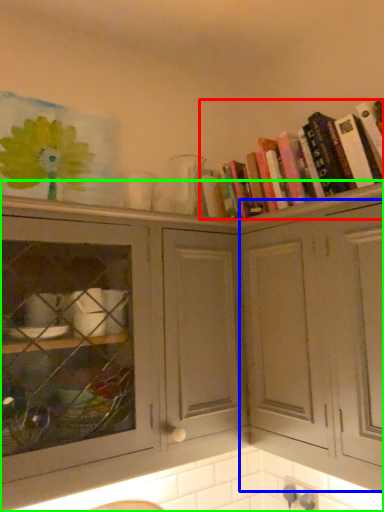
Question: Which object is positioned closest to book (highlighted by a red box)? Select from cabinetry (highlighted by a blue box) and cabinetry (highlighted by a green box).

Choices:
 (A) cabinetry
 (B) cabinetry

Answer: (A)